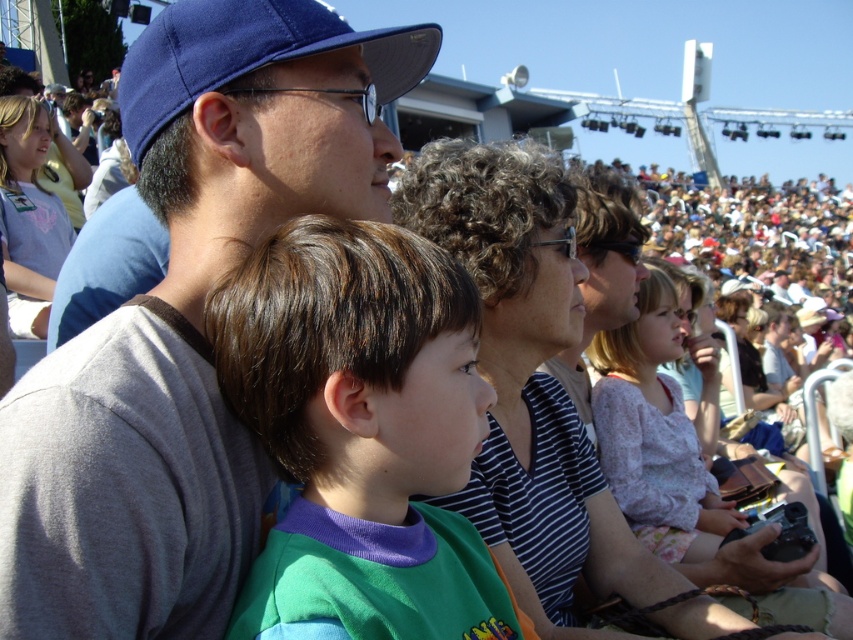
You are standing at the center of the arena looking towards the stage. There is a point marked at coordinates [187,320]. What object is located at that point?

The point at [187,320] corresponds to the blue fabric cap at upper left.

You are an event planner trying to arrange a photo shoot in the stadium. You need to place a large banner between the green fabric shirt at center and the blue fabric baseball cap at upper left. Which object should the banner be closer to to ensure it doesn

The green fabric shirt at center occupies less space than the blue fabric baseball cap at upper left, so the banner should be placed closer to the blue fabric baseball cap at upper left to balance the visual weight between the two objects.